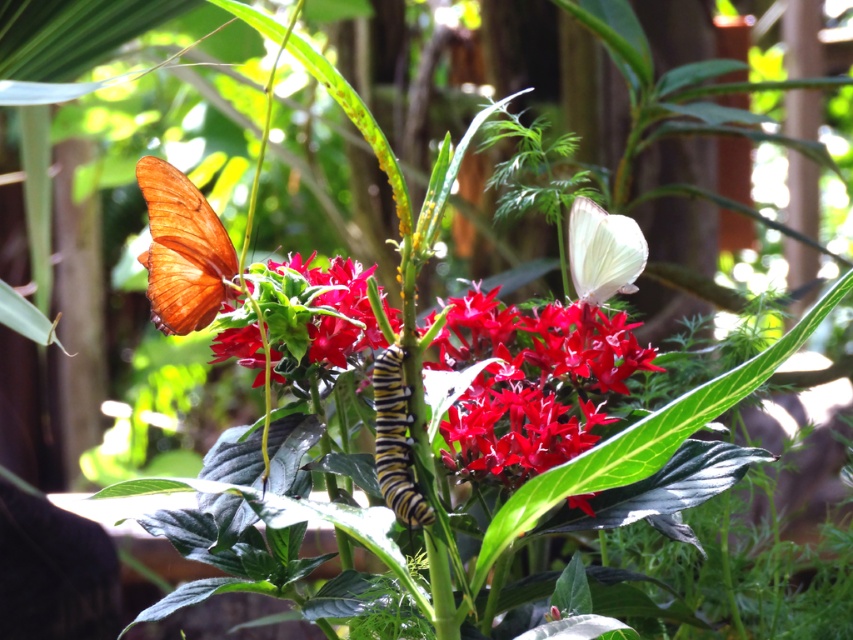
You are a gardener who wants to place a small statue between the smooth glossy red flower at center and the matte white butterfly at upper right. Since the statue is 20 cm tall, will it fit between them vertically?

The smooth glossy red flower at center is taller than the matte white butterfly at upper right. However, the exact vertical distance between them isn generated in the description. Therefore, it is unclear if the 20 cm statue will fit vertically between them.

You are a gardener who wants to place a small statue between the smooth glossy red flower at center and the matte white butterfly at upper right. Based on their positions, where should the statue be placed?

The smooth glossy red flower at center is below the matte white butterfly at upper right, so the statue should be placed between them, above the flower and below the butterfly to maintain their spatial relationship.